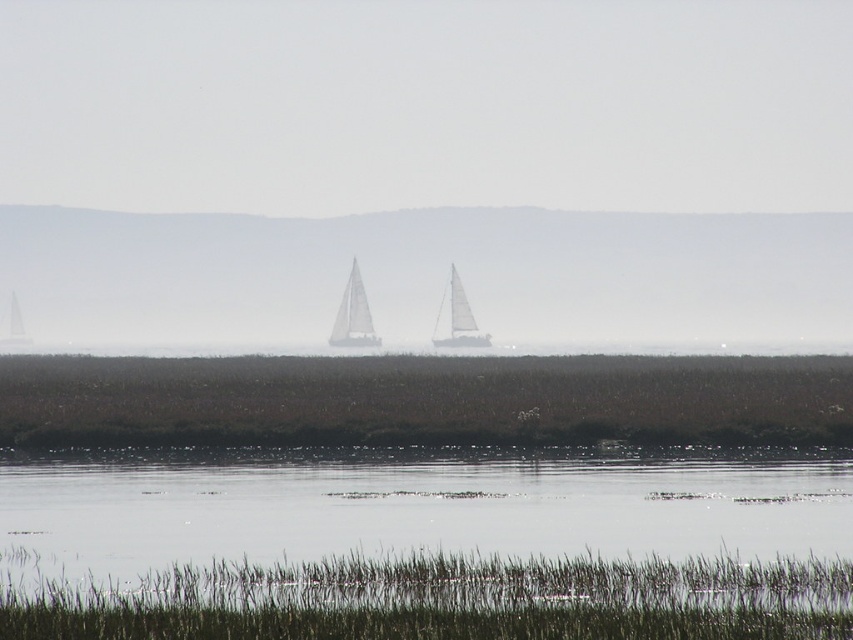
You are a sailor navigating a small boat and want to reach the point marked as point (428, 529). According to the image, where is this point located?

The point (428, 529) is on clear water at lower center, so you can safely navigate your boat to that location.

You are a photographer standing at the edge of the water. You notice the clear water at lower center and the brown grass at lower center in your viewfinder. Which object appears taller in the photo?

The brown grass at lower center appears taller than the clear water at lower center in the photo because the clear water at lower center is not as tall as brown grass at lower center.